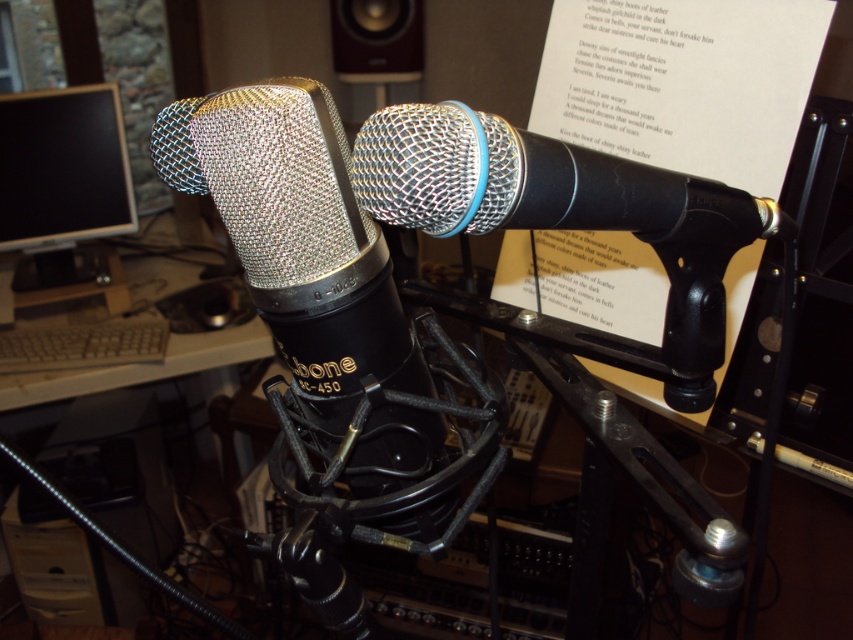
Question: Which point is closer to the camera?

Choices:
 (A) matte silver mesh microphone at center
 (B) silver mesh microphone at center
 (C) matte brown speaker at upper center
 (D) black glossy monitor at left

Answer: (B)

Question: Is matte silver mesh microphone at center wider than gray plastic keyboard at lower left?

Choices:
 (A) no
 (B) yes

Answer: (A)

Question: Can you confirm if matte silver mesh microphone at center is positioned to the right of silver mesh microphone at center?

Choices:
 (A) yes
 (B) no

Answer: (B)

Question: From the image, what is the correct spatial relationship of silver mesh microphone at center in relation to black glossy monitor at left?

Choices:
 (A) above
 (B) below

Answer: (B)

Question: Which of the following is the closest to the observer?

Choices:
 (A) (93, 209)
 (B) (71, 294)

Answer: (B)

Question: Which of the following is the closest to the observer?

Choices:
 (A) (352, 161)
 (B) (33, 273)
 (C) (302, 333)

Answer: (A)